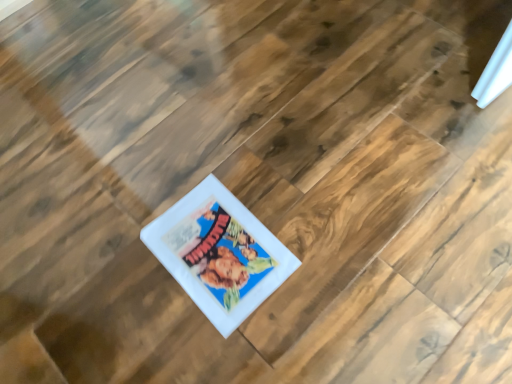
This screenshot has height=384, width=512. Find the location of `vacant space in front of white plastic picture frame at center`. vacant space in front of white plastic picture frame at center is located at coordinates (213, 337).